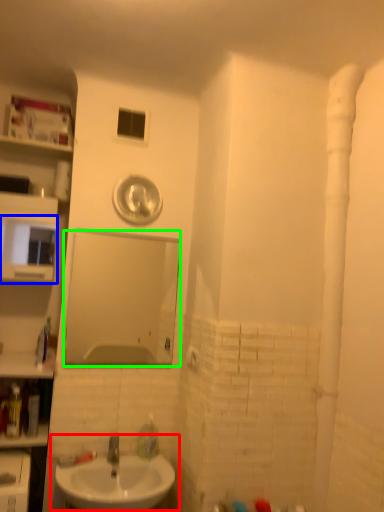
Question: Based on their relative distances, which object is nearer to sink (highlighted by a red box)? Choose from medicine cabinet (highlighted by a blue box) and mirror (highlighted by a green box).

Choices:
 (A) medicine cabinet
 (B) mirror

Answer: (B)